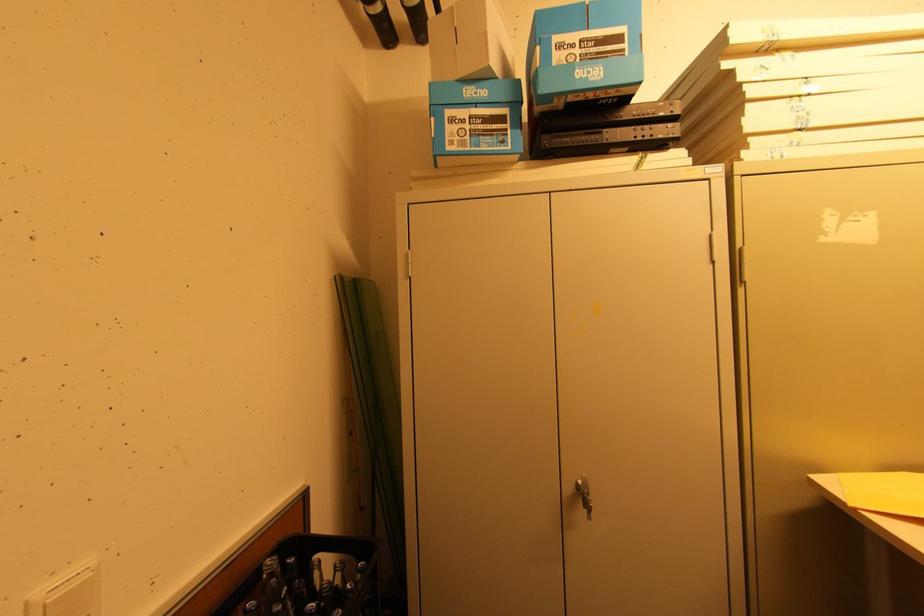
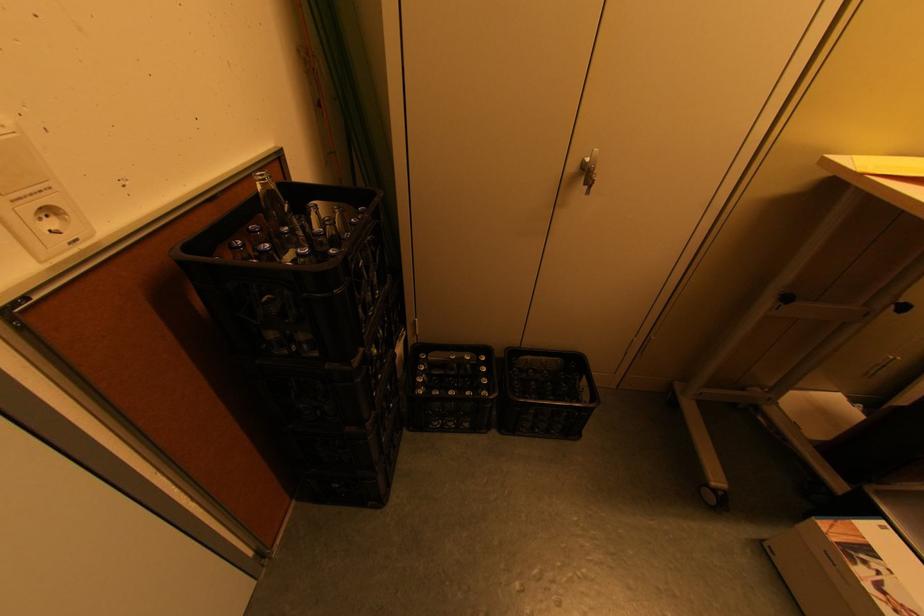
Where in the second image is the point corresponding to [341,564] from the first image?

(338, 208)